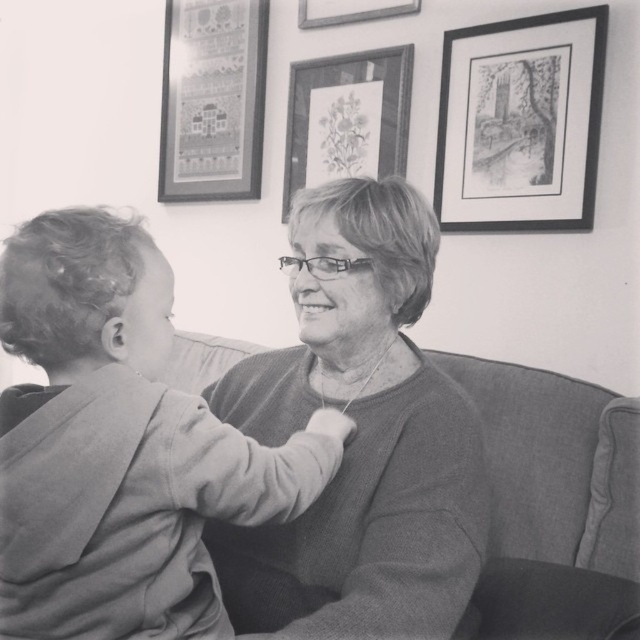
Question: Is black paper picture frame at upper right to the left of matte paper picture frame at upper center from the viewer's perspective?

Choices:
 (A) no
 (B) yes

Answer: (A)

Question: Based on their relative distances, which object is nearer to the silky fabric picture frame at upper left?

Choices:
 (A) knitted sweater at center
 (B) soft gray sweater at left
 (C) black paper picture frame at upper right
 (D) matte paper picture frame at upper center

Answer: (D)

Question: Observing the image, what is the correct spatial positioning of textured fabric couch at center in reference to black paper picture frame at upper right?

Choices:
 (A) left
 (B) right

Answer: (A)

Question: Which is farther from the matte paper picture frame at upper center?

Choices:
 (A) black paper picture frame at upper right
 (B) knitted sweater at center

Answer: (B)

Question: Estimate the real-world distances between objects in this image. Which object is closer to the soft gray sweater at left?

Choices:
 (A) textured fabric couch at center
 (B) metallic silver picture frame at upper center

Answer: (A)

Question: Does textured fabric couch at center have a greater width compared to silky fabric picture frame at upper left?

Choices:
 (A) no
 (B) yes

Answer: (B)